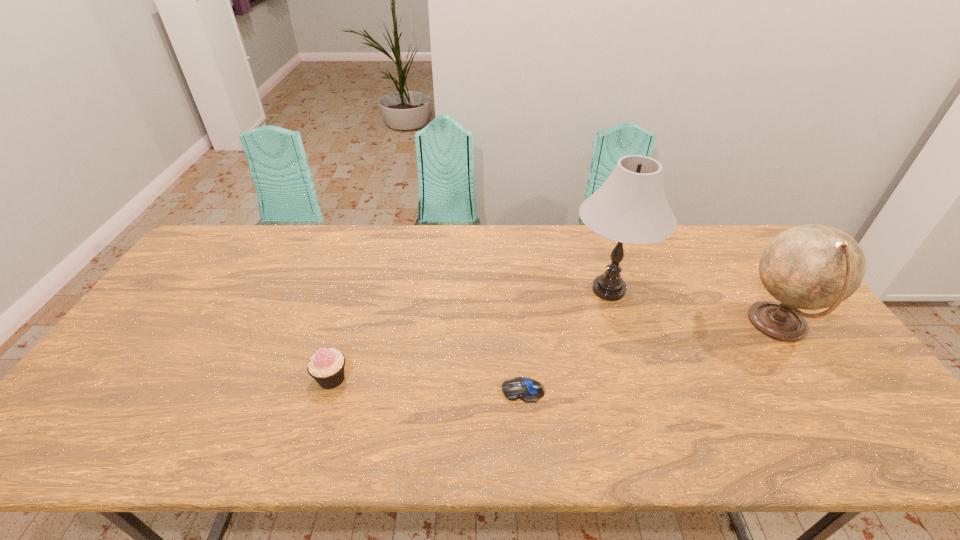
The height and width of the screenshot is (540, 960). I want to click on free space at the left edge, so click(170, 306).

In the image, there is a desktop. Identify the location of free space at the right edge. Image resolution: width=960 pixels, height=540 pixels. (853, 379).

In the image, there is a desktop. Identify the location of free space at the far right corner. This screenshot has height=540, width=960. tap(732, 230).

The height and width of the screenshot is (540, 960). I want to click on vacant area between the third object from left to right and the second tallest object, so click(x=693, y=307).

This screenshot has width=960, height=540. I want to click on free space that is in between the second object from left to right and the lamp, so click(565, 340).

This screenshot has height=540, width=960. Identify the location of free point between the third object from right to left and the second tallest object. (650, 357).

What are the coordinates of `vacant region between the second tallest object and the cupcake` in the screenshot? It's located at (555, 352).

The image size is (960, 540). In order to click on free space between the third shortest object and the computer mouse in this screenshot , I will do `click(650, 357)`.

The height and width of the screenshot is (540, 960). I want to click on vacant region between the tallest object and the second tallest object, so click(x=693, y=307).

The image size is (960, 540). I want to click on free spot between the leftmost object and the second tallest object, so click(555, 352).